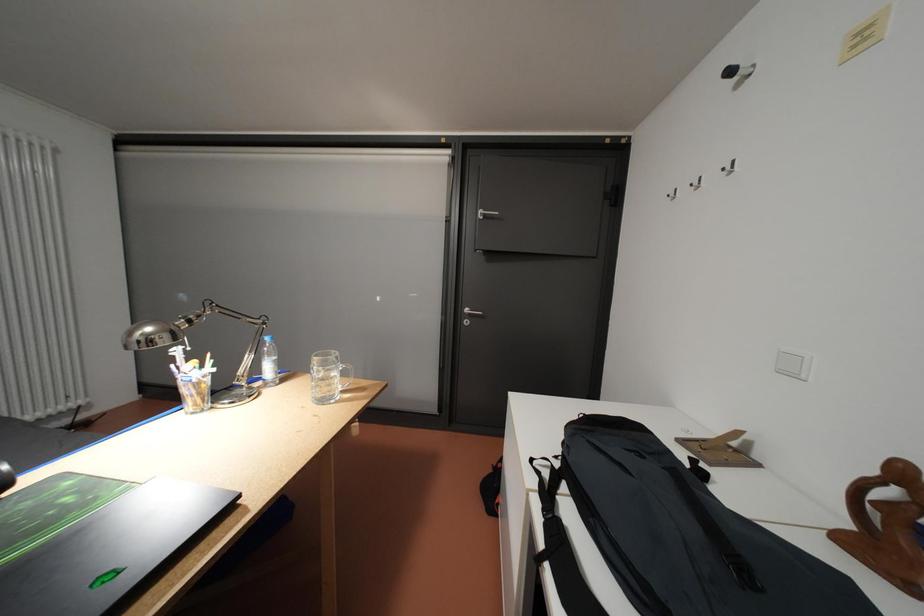
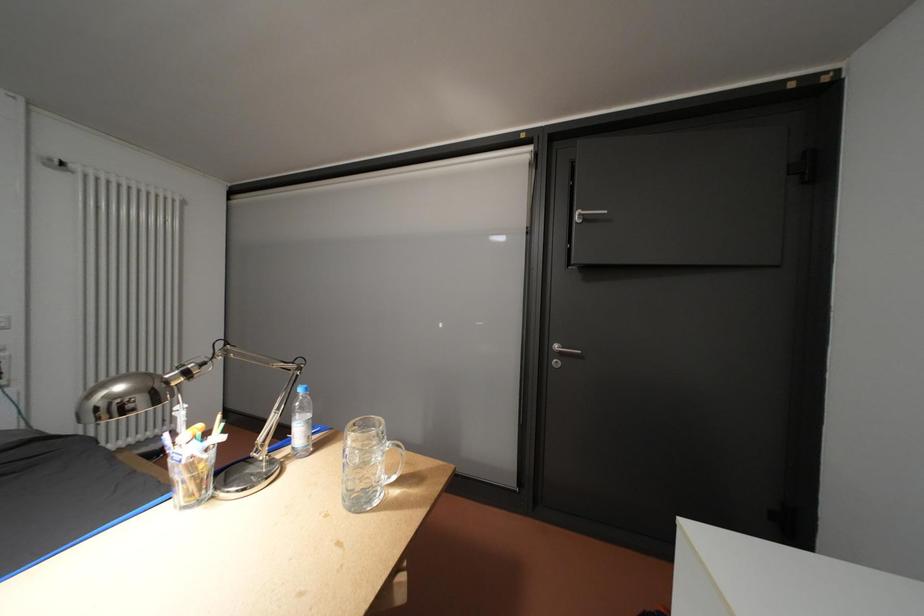
Question: The camera is either moving clockwise (left) or counter-clockwise (right) around the object. The first image is from the beginning of the video and the second image is from the end. Is the camera moving left or right when shooting the video?

Choices:
 (A) Left
 (B) Right

Answer: (B)